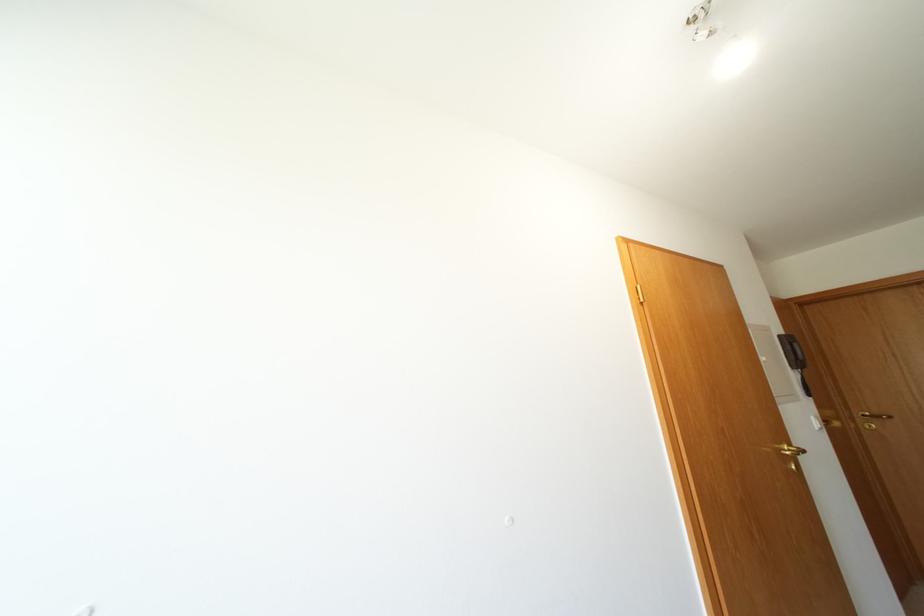
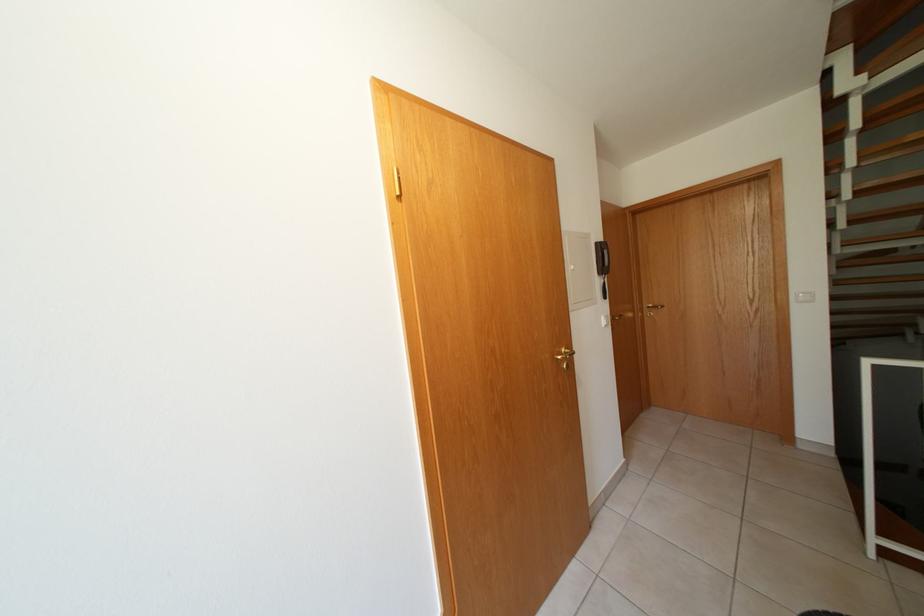
First-person continuous shooting, in which direction is the camera rotating?

The camera rotated toward right-down.